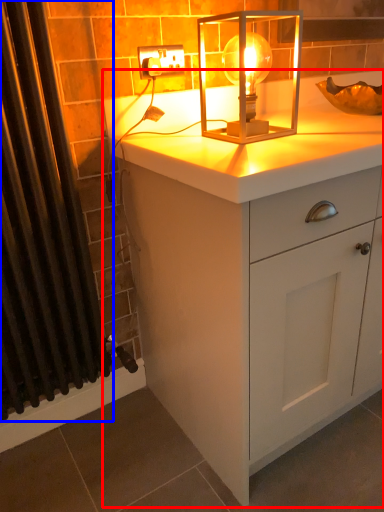
Question: Which point is closer to the camera, chest of drawers (highlighted by a red box) or shower curtain (highlighted by a blue box)?

Choices:
 (A) chest of drawers
 (B) shower curtain

Answer: (B)